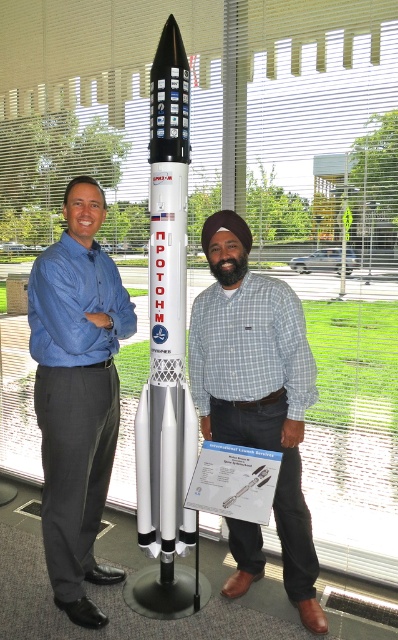
You are standing at the point marked as point (76, 394) in the image. What is the closest object to you?

The closest object to you at point (76, 394) is the blue shirt at center.

In the scene, there are a blue shirt at center and a white matte rocket at center. Which object is positioned to the left?

The blue shirt at center is to the left of the white matte rocket at center.